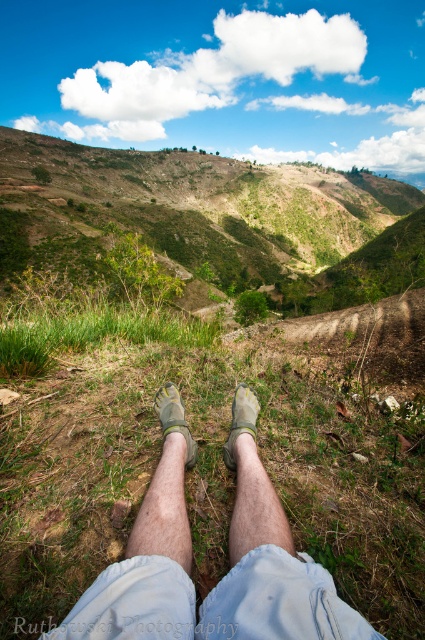
In the scene shown: You are wearing a pair of light gray fabric legs at center and a single light gray fabric leg at center. Which one is wider?

The light gray fabric legs at center is wider than the light gray fabric leg at center.

You are taking a break on a grassy slope and want to place your water bottle at the point marked as point (155, 593). If your arm can reach 3 feet, can you reach that point without moving?

The distance between point (155, 593) and the camera is 3.49 feet. Since your arm can only reach 3 feet, you cannot reach that point without moving.